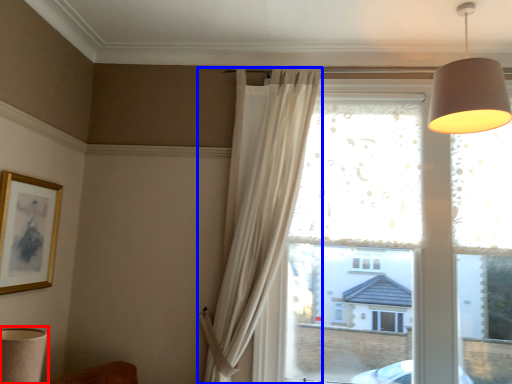
Question: Which object appears closest to the camera in this image, table lamp (highlighted by a red box) or curtain (highlighted by a blue box)?

Choices:
 (A) table lamp
 (B) curtain

Answer: (A)